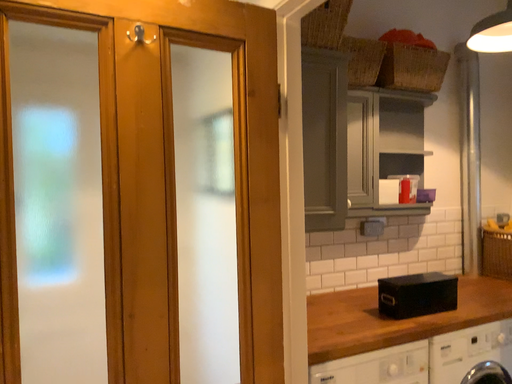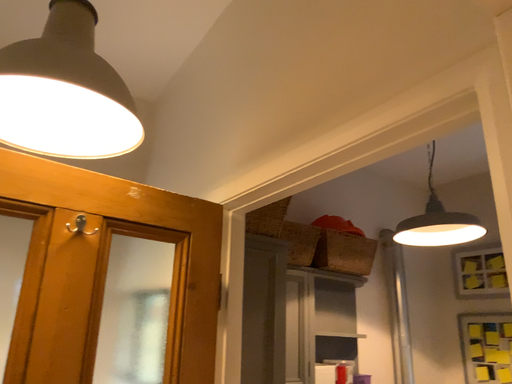
Question: How did the camera likely rotate when shooting the video?

Choices:
 (A) rotated left
 (B) rotated right

Answer: (B)